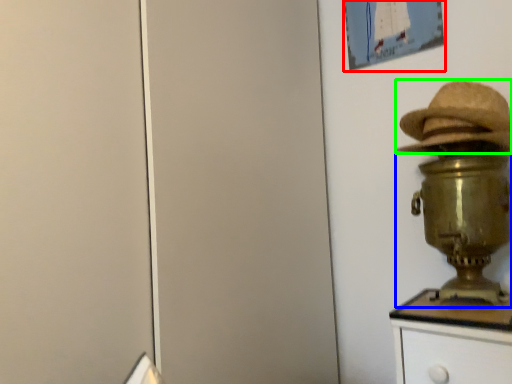
Question: Considering the real-world distances, which object is farthest from picture frame (highlighted by a red box)? table lamp (highlighted by a blue box) or hat (highlighted by a green box)?

Choices:
 (A) table lamp
 (B) hat

Answer: (A)